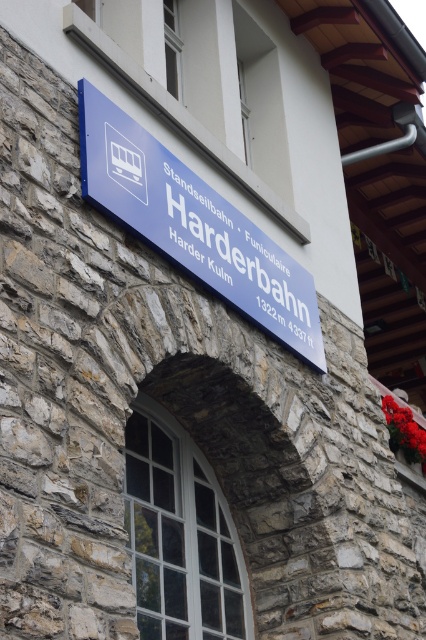
You are a tourist standing in front of the stone building and want to read both the blue plastic sign at upper center and the blue plastic sign at center. Which sign will you need to look up higher to read?

The blue plastic sign at upper center is much taller than the blue plastic sign at center, so you will need to look up higher to read the blue plastic sign at upper center.

You are a tourist standing in front of the stone building and want to read both the blue plastic sign at upper center and the blue plastic sign at center. Which sign can you see more clearly?

The blue plastic sign at upper center is in front of the blue plastic sign at center, so you can see the blue plastic sign at upper center more clearly.